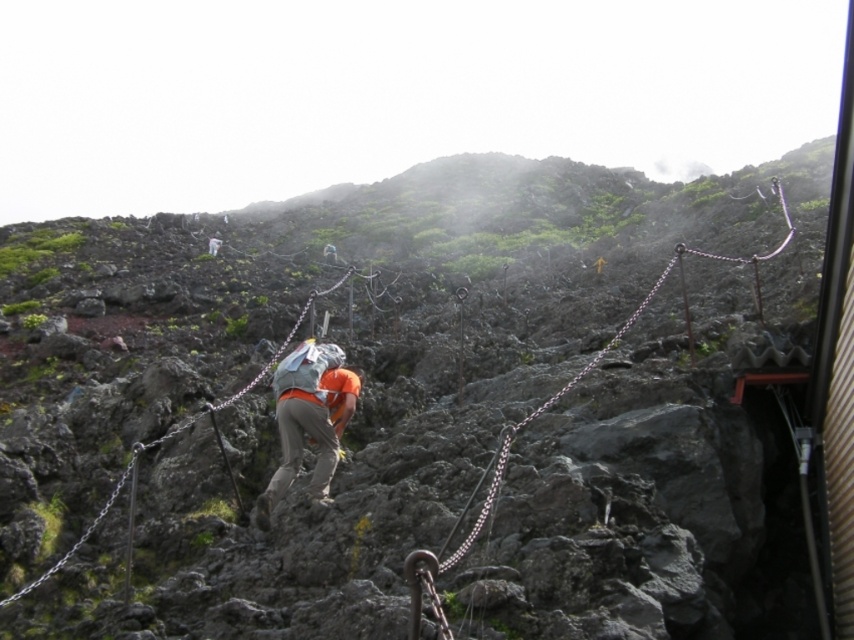
Is rusty chain at upper center further to camera compared to metallic chain at center?

No, it is in front of metallic chain at center.

Between rusty chain at upper center and metallic chain at center, which one has less height?

With less height is metallic chain at center.

Which is in front, point (782, 243) or point (184, 424)?

Point (184, 424) is in front.

Identify the location of rusty chain at upper center. The width and height of the screenshot is (854, 640). (595, 365).

Is orange fabric backpack at center taller than rusty chain at upper center?

No.

Which is more to the right, orange fabric backpack at center or rusty chain at upper center?

rusty chain at upper center

Describe the element at coordinates (309, 419) in the screenshot. I see `orange fabric backpack at center` at that location.

You are a GUI agent. You are given a task and a screenshot of the screen. Output one action in this format:
    pyautogui.click(x=<x>, y=<y>)
    Task: Click on the orange fabric backpack at center
    
    Given the screenshot: What is the action you would take?
    pyautogui.click(x=309, y=419)

Does orange fabric backpack at center have a lesser height compared to metallic chain at center?

Correct, orange fabric backpack at center is not as tall as metallic chain at center.

Is point (282, 428) positioned before point (199, 417)?

Yes, it is.

Who is more distant from viewer, (300,435) or (45,577)?

Point (300,435)

Find the location of `orange fabric backpack at center`. orange fabric backpack at center is located at coordinates (309, 419).